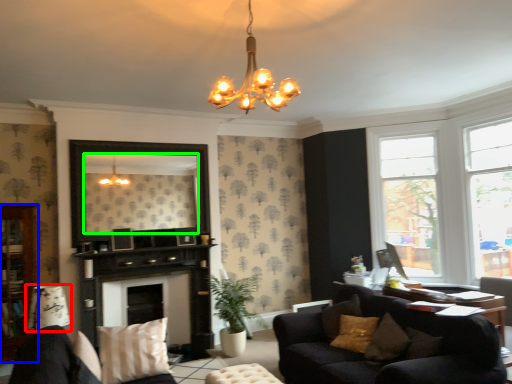
Question: Which is farther away from lamp (highlighted by a red box)? cabinetry (highlighted by a blue box) or mirror (highlighted by a green box)?

Choices:
 (A) cabinetry
 (B) mirror

Answer: (B)